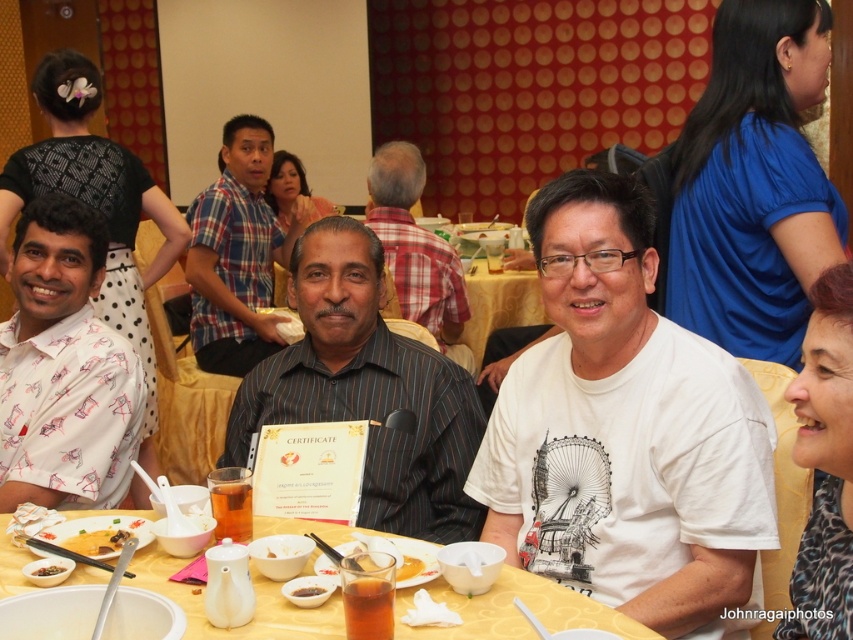
You are standing in the banquet hall and want to place a small decoration between the two points marked as point (518, 273) and point (289, 541). Based on their positions, which point is closer to you so that the decoration can be placed appropriately?

Point (289, 541) is closer to you than point (518, 273), so you should place the decoration closer to point (289, 541) to ensure it is accessible.